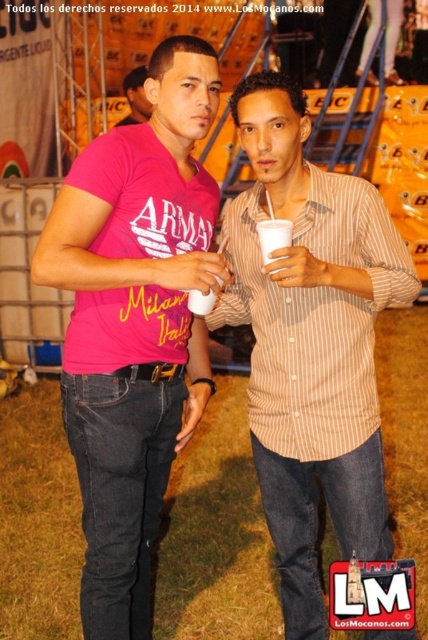
Question: Is matte pink t-shirt at center closer to camera compared to white plastic cup at center?

Choices:
 (A) no
 (B) yes

Answer: (B)

Question: Which point is closer to the camera?

Choices:
 (A) white plastic cup at center
 (B) pink fabric shirt at center
 (C) matte pink t-shirt at center
 (D) brown striped shirt at center

Answer: (C)

Question: Among these points, which one is nearest to the camera?

Choices:
 (A) (143, 104)
 (B) (413, 294)

Answer: (B)

Question: Does brown striped shirt at center have a larger size compared to pink fabric shirt at center?

Choices:
 (A) no
 (B) yes

Answer: (B)

Question: Which object is positioned farthest from the pink fabric shirt at center?

Choices:
 (A) brown striped shirt at center
 (B) matte pink t-shirt at center

Answer: (A)

Question: Does matte pink t-shirt at center come in front of white plastic cup at center?

Choices:
 (A) yes
 (B) no

Answer: (A)